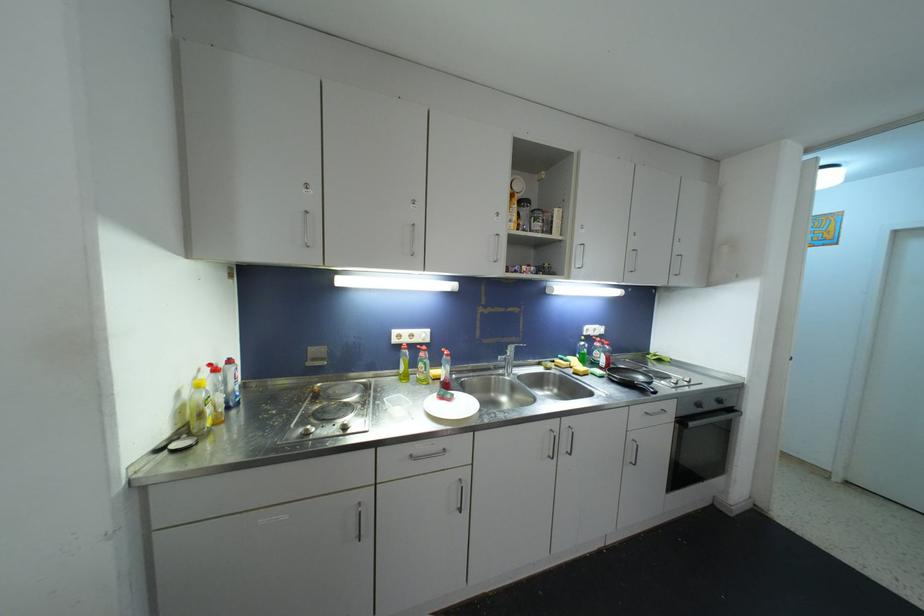
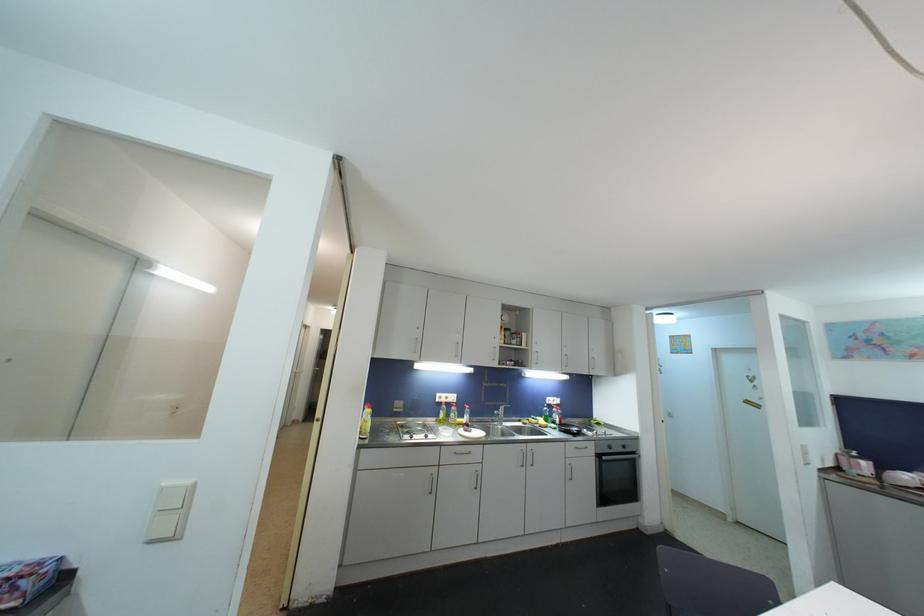
Find the pixel in the second image that matches point (415, 339) in the first image.

(450, 400)